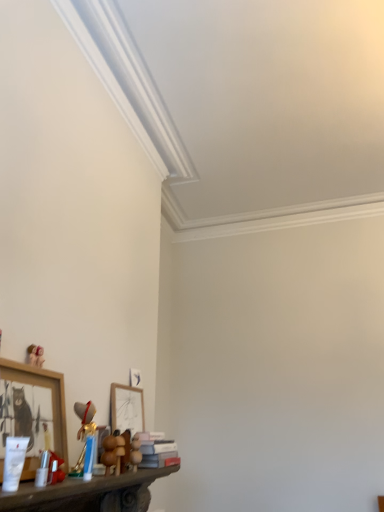
Question: Is point click(x=18, y=365) positioned closer to the camera than point click(x=36, y=345)?

Choices:
 (A) farther
 (B) closer

Answer: (B)

Question: From the image's perspective, is wooden picture frame at lower left, arranged as the 2th picture frame when viewed from the back, positioned above or below matte pink teddy bear at lower left, marked as the first toy in a top-to-bottom arrangement?

Choices:
 (A) above
 (B) below

Answer: (B)

Question: Which of these objects is positioned closest to the wooden carved shelf at lower left?

Choices:
 (A) matte pink teddy bear at lower left, marked as the first toy in a top-to-bottom arrangement
 (B) matte white picture frame at center, the 2th picture frame in the front-to-back sequence
 (C) wooden picture frame at lower left, which is the second picture frame from right to left
 (D) brown plush bear at lower center, which is the first toy from bottom to top
 (E) matte pink book at lower center

Answer: (E)

Question: Considering the real-world distances, which object is closest to the matte pink book at lower center?

Choices:
 (A) matte pink teddy bear at lower left, which is the 1th toy in left-to-right order
 (B) wooden carved shelf at lower left
 (C) matte white picture frame at center, the 2th picture frame in the front-to-back sequence
 (D) brown plush bear at lower center, positioned as the 1th toy in right-to-left order
 (E) wooden bear at lower center, the second toy ordered from the bottom

Answer: (D)